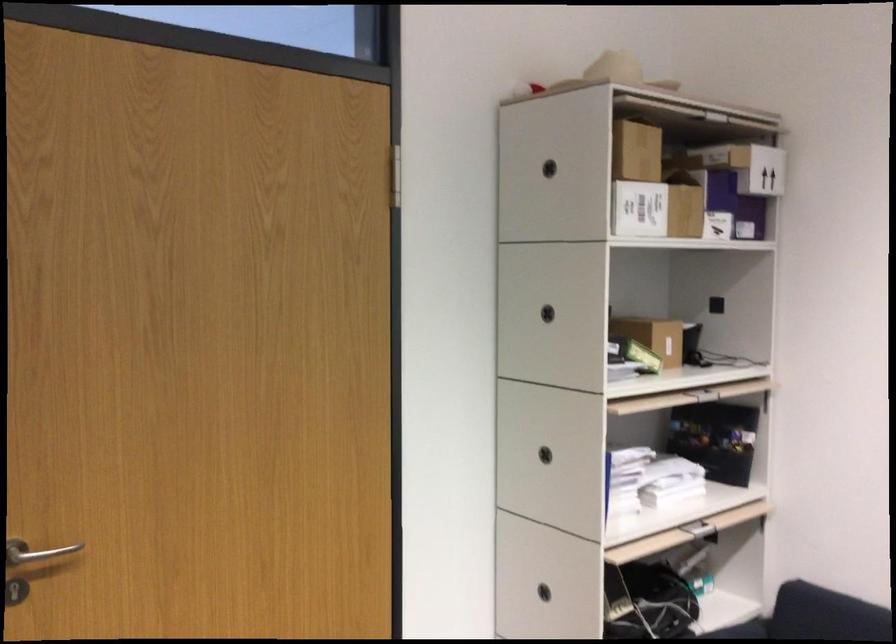
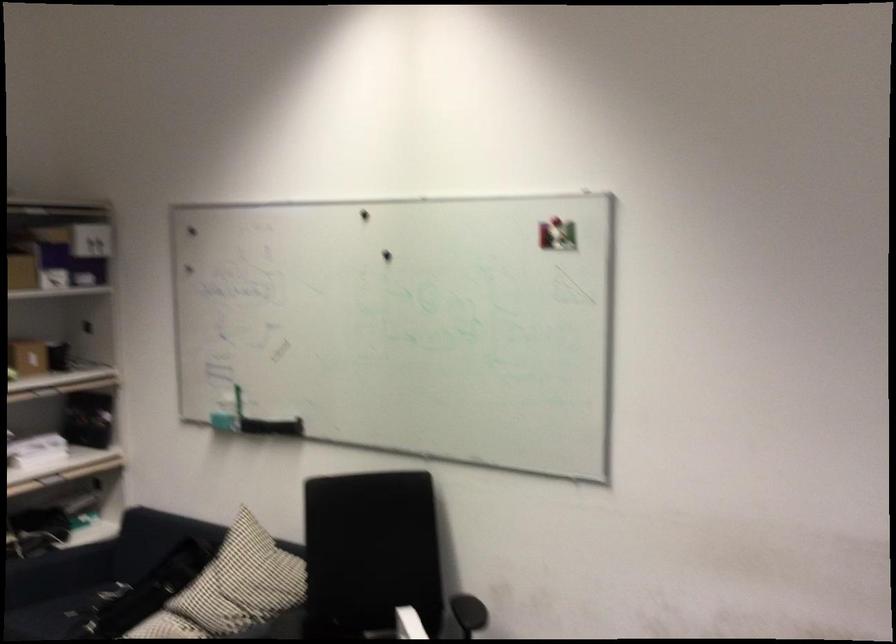
Which direction would the cameraman need to move to produce the second image?

The cameraman walked toward right, backward.